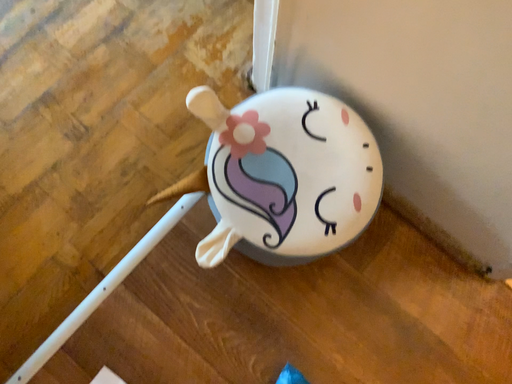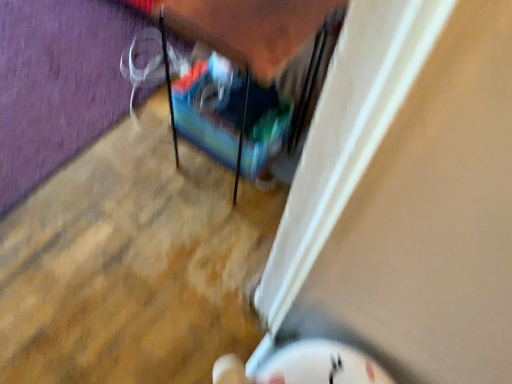
Question: How did the camera likely rotate when shooting the video?

Choices:
 (A) rotated upward
 (B) rotated downward

Answer: (A)